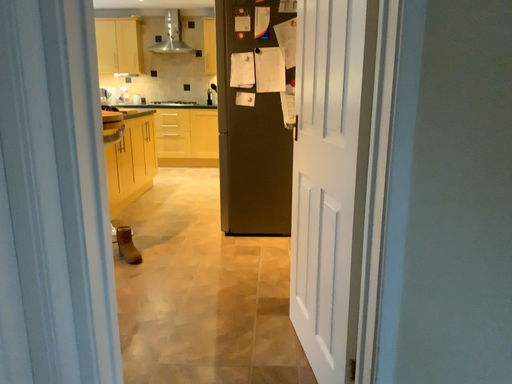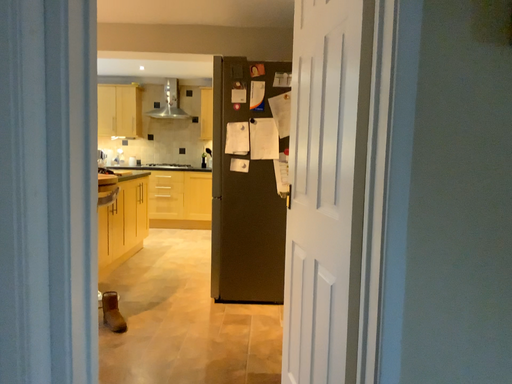
Question: Which way did the camera rotate in the video?

Choices:
 (A) rotated downward
 (B) rotated upward

Answer: (B)